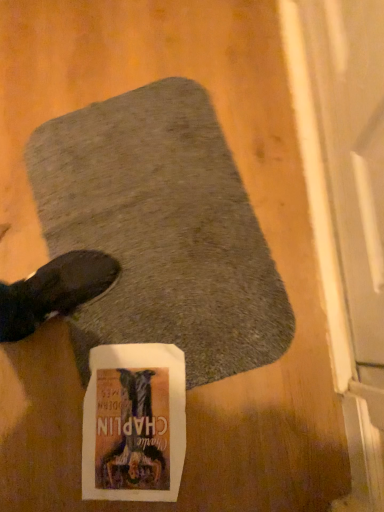
Where is `free space behind white paper flyer at center`? free space behind white paper flyer at center is located at coordinates (100, 327).